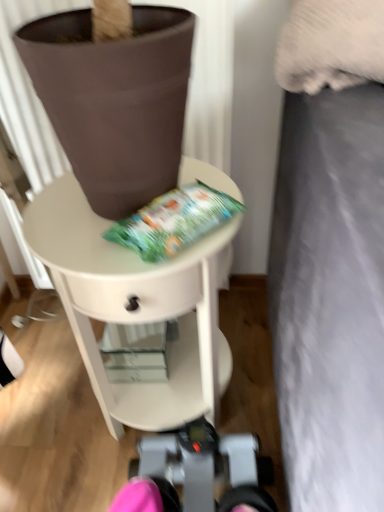
At what (x,y) coordinates should I click in order to perform the action: click on vacant area that lies to the right of white glossy table at center. Please return your answer as a coordinate pair (x, y). Looking at the image, I should click on (249, 387).